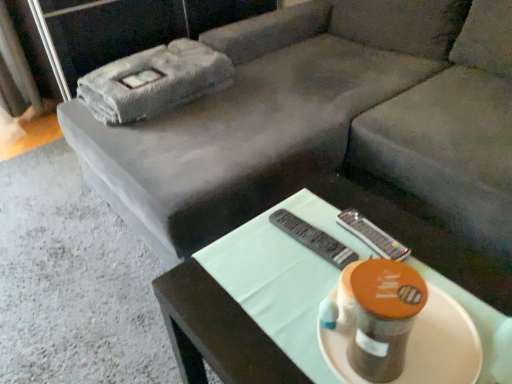
Locate an element on the screen. The image size is (512, 384). free space to the left of black plastic remote at center is located at coordinates (240, 262).